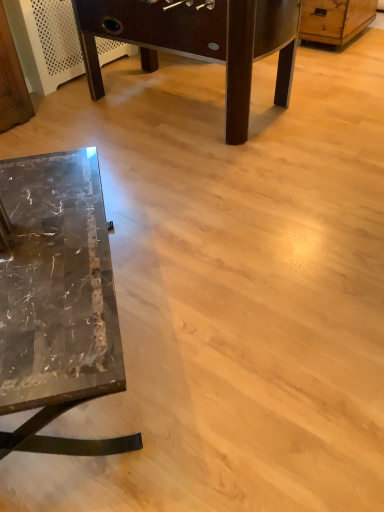
Find the location of a particular element. The height and width of the screenshot is (512, 384). free spot to the right of marble table at lower left, the 1th table from the back is located at coordinates (331, 97).